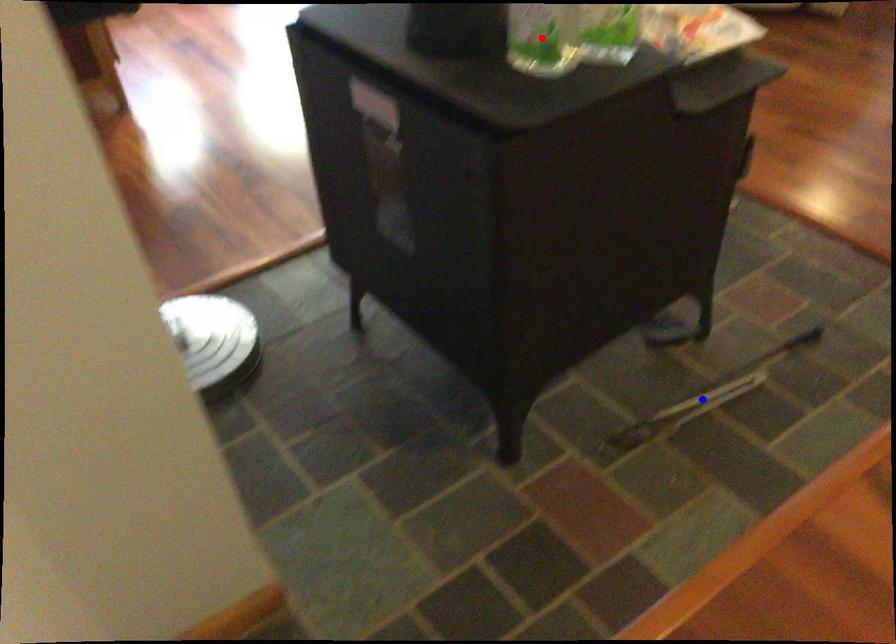
Question: In the image, two points are highlighted. Which point is nearer to the camera? Reply with the corresponding letter.

Choices:
 (A) blue point
 (B) red point

Answer: (B)